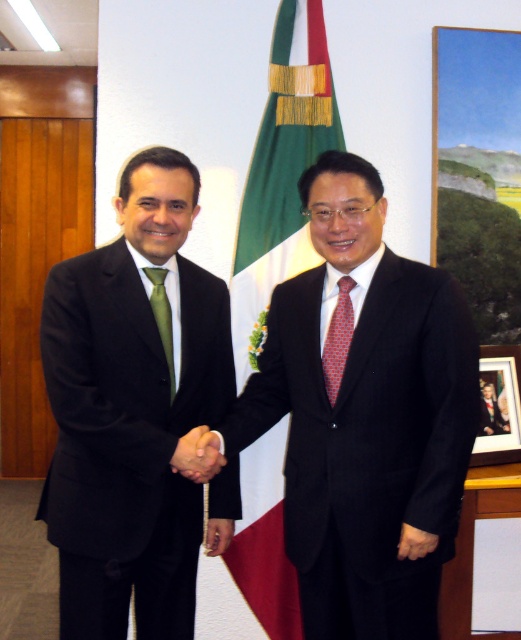
Question: Is matte black suit at center smaller than green fabric flag at center?

Choices:
 (A) no
 (B) yes

Answer: (A)

Question: Is green fabric flag at center below green silk tie at center?

Choices:
 (A) no
 (B) yes

Answer: (A)

Question: Among these objects, which one is farthest from the camera?

Choices:
 (A) green silk tie at center
 (B) green fabric flag at center
 (C) dark suit at center

Answer: (B)

Question: Which point appears farthest from the camera in this image?

Choices:
 (A) (328, 333)
 (B) (160, 301)
 (C) (48, 292)
 (D) (517, 392)

Answer: (D)

Question: Estimate the real-world distances between objects in this image. Which object is closer to the dark suit at center?

Choices:
 (A) red dotted tie at center
 (B) wooden picture frame at right

Answer: (A)

Question: Is dark suit at center below green silk tie at center?

Choices:
 (A) no
 (B) yes

Answer: (B)